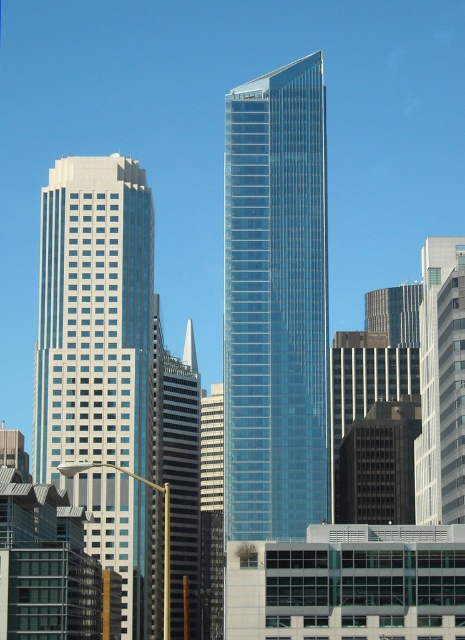
Question: Which point is farther from the camera taking this photo?

Choices:
 (A) (79, 337)
 (B) (426, 417)

Answer: (B)

Question: Based on their relative distances, which object is nearer to the white glass building at right?

Choices:
 (A) transparent glass skyscraper at center
 (B) white glass building at left

Answer: (A)

Question: Is white glass building at left wider than white glass building at right?

Choices:
 (A) yes
 (B) no

Answer: (A)

Question: Is transparent glass skyscraper at center smaller than white glass building at left?

Choices:
 (A) no
 (B) yes

Answer: (A)

Question: Does white glass building at left lie behind white glass building at right?

Choices:
 (A) no
 (B) yes

Answer: (B)

Question: Which object is the farthest from the white glass building at left?

Choices:
 (A) transparent glass skyscraper at center
 (B) white glass building at right

Answer: (B)